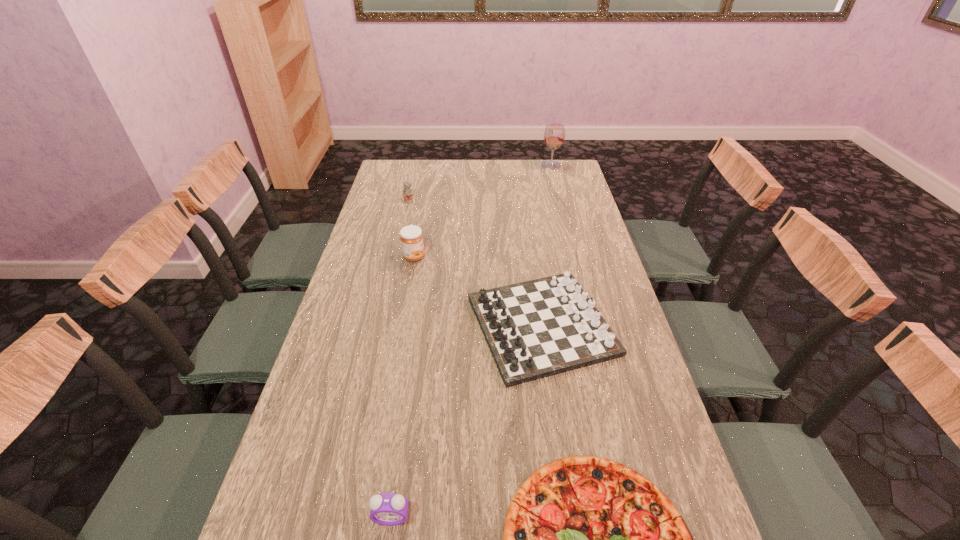
What are the coordinates of `free location located 0.080m on the front-facing side of the second farthest object` in the screenshot? It's located at (406, 213).

Find the location of a particular element. object that is at the far edge is located at coordinates (554, 135).

I want to click on object that is at the left edge, so click(407, 194).

At what (x,y) coordinates should I click in order to perform the action: click on wineglass located at the right edge. Please return your answer as a coordinate pair (x, y). The image size is (960, 540). Looking at the image, I should click on (554, 135).

Find the location of a particular element. Image resolution: width=960 pixels, height=540 pixels. chessboard located in the right edge section of the desktop is located at coordinates (539, 328).

Find the location of a particular element. object at the far right corner is located at coordinates (554, 135).

Locate an element on the screen. vacant region at the far edge is located at coordinates (480, 181).

Locate an element on the screen. This screenshot has height=540, width=960. free point at the left edge is located at coordinates (341, 399).

Find the location of a particular element. vacant space at the right edge of the desktop is located at coordinates (573, 196).

Find the location of `free space at the far right corner of the desktop`. free space at the far right corner of the desktop is located at coordinates (570, 177).